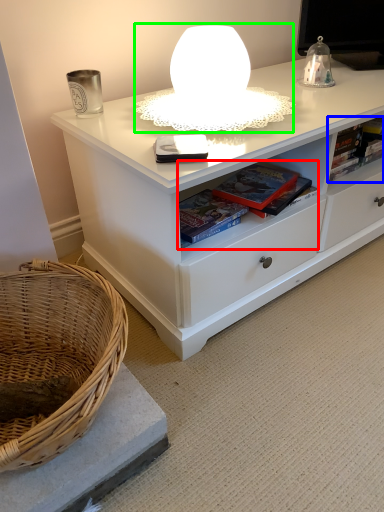
Question: Estimate the real-world distances between objects in this image. Which object is closer to book (highlighted by a red box), book (highlighted by a blue box) or table lamp (highlighted by a green box)?

Choices:
 (A) book
 (B) table lamp

Answer: (B)